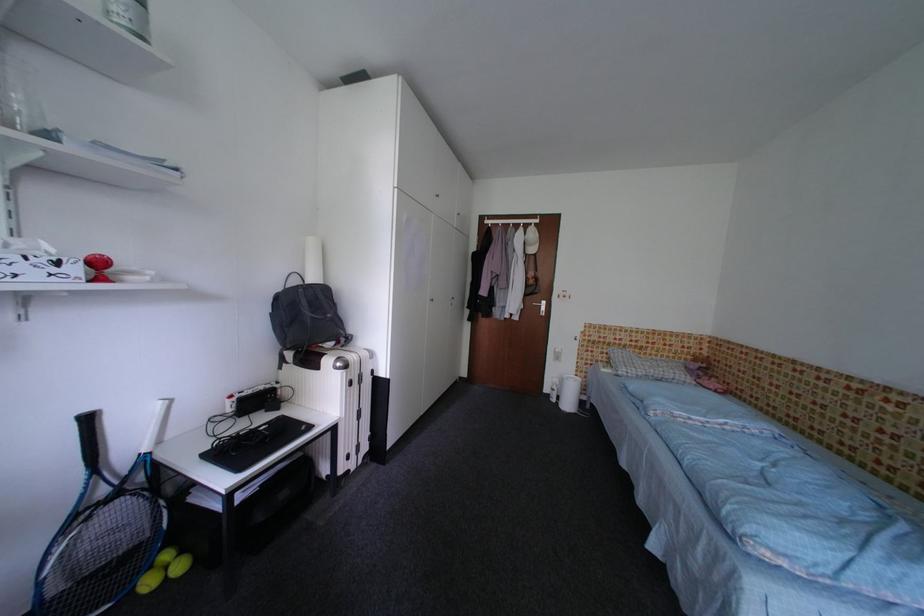
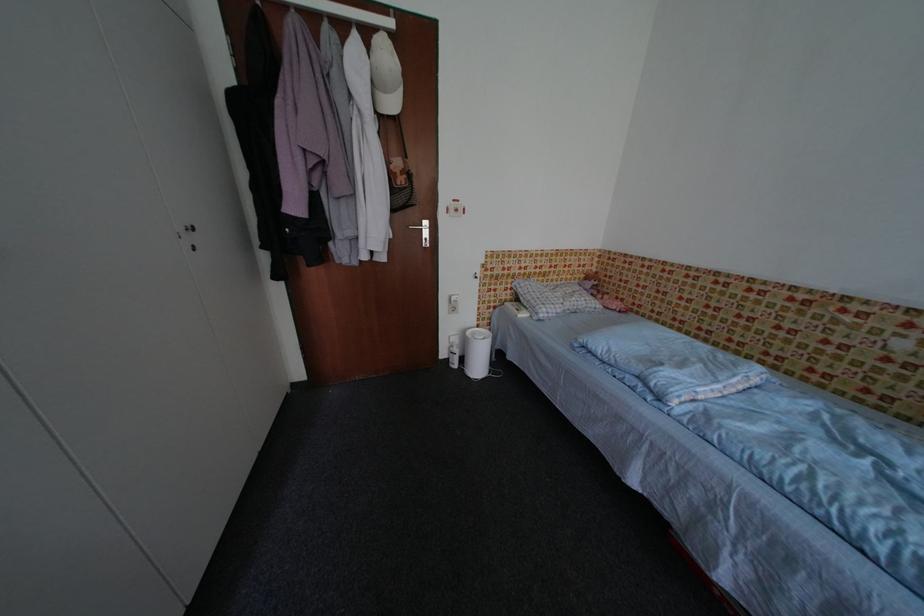
In the second image, find the point that corresponds to the point at 675,360 in the first image.

(574, 282)